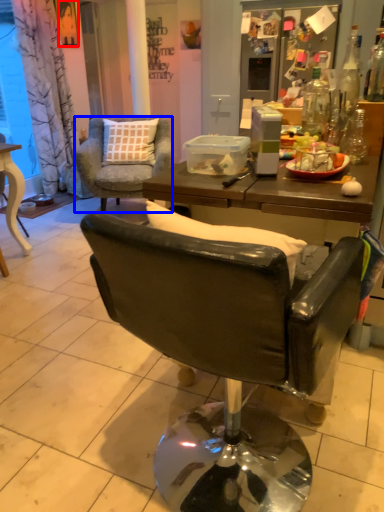
Question: Which point is further to the camera, person (highlighted by a red box) or chair (highlighted by a blue box)?

Choices:
 (A) person
 (B) chair

Answer: (A)